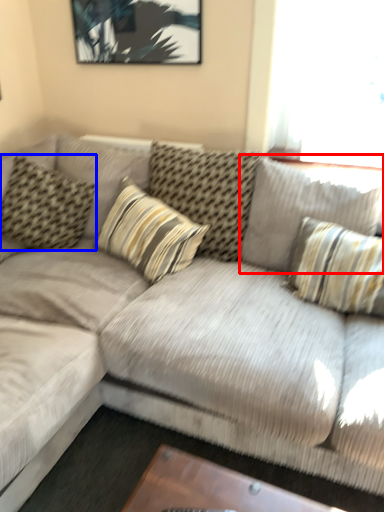
Question: Which object appears farthest to the camera in this image, pillow (highlighted by a red box) or pillow (highlighted by a blue box)?

Choices:
 (A) pillow
 (B) pillow

Answer: (B)